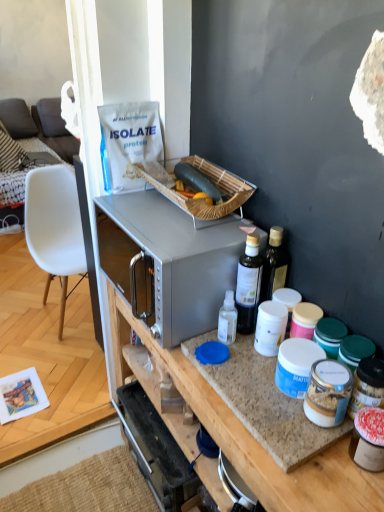
Question: Is satin silver microwave at center bigger than bamboo picnic basket at upper center?

Choices:
 (A) no
 (B) yes

Answer: (B)

Question: From the image's perspective, would you say satin silver microwave at center is shown under bamboo picnic basket at upper center?

Choices:
 (A) no
 (B) yes

Answer: (B)

Question: From a real-world perspective, is satin silver microwave at center on top of bamboo picnic basket at upper center?

Choices:
 (A) yes
 (B) no

Answer: (B)

Question: From a real-world perspective, is satin silver microwave at center below bamboo picnic basket at upper center?

Choices:
 (A) yes
 (B) no

Answer: (A)

Question: Is satin silver microwave at center shorter than bamboo picnic basket at upper center?

Choices:
 (A) no
 (B) yes

Answer: (A)

Question: Does satin silver microwave at center come behind bamboo picnic basket at upper center?

Choices:
 (A) yes
 (B) no

Answer: (B)

Question: Can you confirm if green matte zucchini at center is taller than granite countertop at center?

Choices:
 (A) yes
 (B) no

Answer: (B)

Question: Is green matte zucchini at center wider than granite countertop at center?

Choices:
 (A) yes
 (B) no

Answer: (B)

Question: Does green matte zucchini at center lie behind granite countertop at center?

Choices:
 (A) yes
 (B) no

Answer: (A)

Question: Can you confirm if green matte zucchini at center is shorter than granite countertop at center?

Choices:
 (A) yes
 (B) no

Answer: (A)

Question: Can granite countertop at center be found inside green matte zucchini at center?

Choices:
 (A) no
 (B) yes

Answer: (A)

Question: Is green matte zucchini at center to the right of granite countertop at center from the viewer's perspective?

Choices:
 (A) yes
 (B) no

Answer: (B)

Question: Could granite countertop at center be considered to be inside granite countertop at center?

Choices:
 (A) yes
 (B) no

Answer: (B)